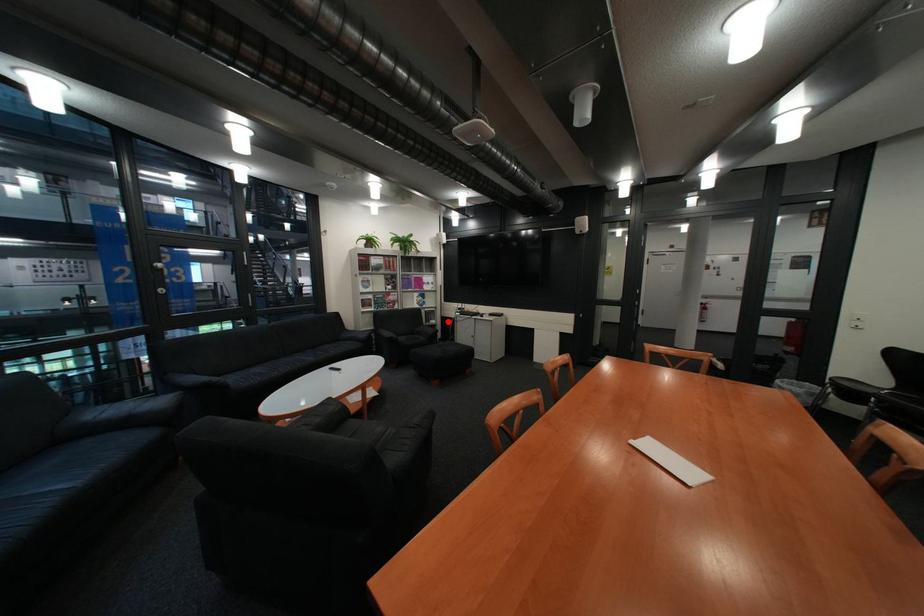
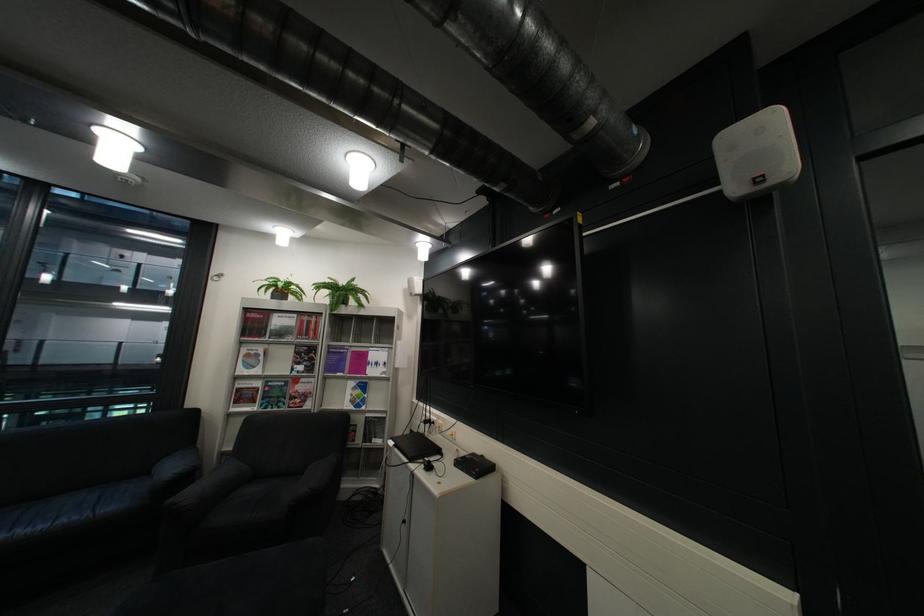
Locate, in the second image, the point that corresponds to the highlighted location in the first image.

(393, 442)